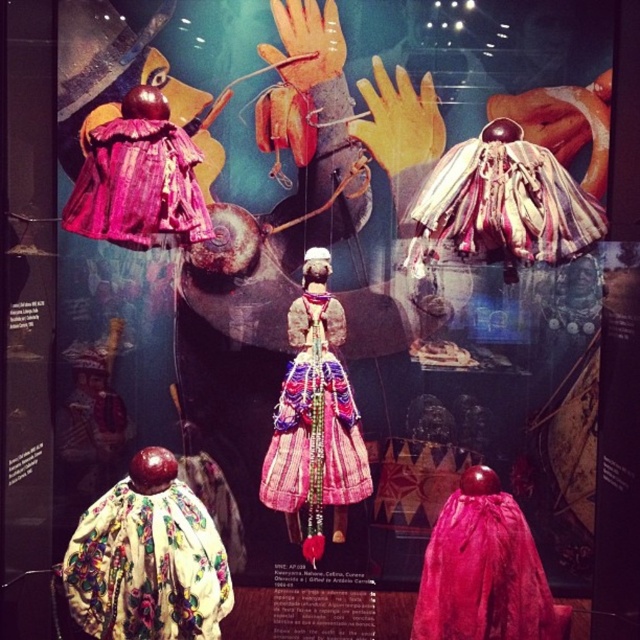
Does satin skirt at lower right appear on the right side of multicolored fabric dress at center?

Yes, satin skirt at lower right is to the right of multicolored fabric dress at center.

Which is above, satin skirt at lower right or multicolored fabric dress at center?

multicolored fabric dress at center

Image resolution: width=640 pixels, height=640 pixels. What do you see at coordinates (483, 573) in the screenshot?
I see `satin skirt at lower right` at bounding box center [483, 573].

Where is `satin skirt at lower right`? satin skirt at lower right is located at coordinates (483, 573).

Between point (150, 561) and point (481, 525), which one is positioned in front?

Point (150, 561) is more forward.

From the picture: Does floral fabric cape at lower left have a smaller size compared to satin skirt at lower right?

Yes.

This screenshot has height=640, width=640. I want to click on floral fabric cape at lower left, so click(x=147, y=566).

Can you confirm if satin skirt at lower right is positioned to the right of purple textured fabric dress at upper left?

Correct, you'll find satin skirt at lower right to the right of purple textured fabric dress at upper left.

Is satin skirt at lower right bigger than purple textured fabric dress at upper left?

Correct, satin skirt at lower right is larger in size than purple textured fabric dress at upper left.

At what (x,y) coordinates should I click in order to perform the action: click on satin skirt at lower right. Please return your answer as a coordinate pair (x, y). This screenshot has width=640, height=640. Looking at the image, I should click on (483, 573).